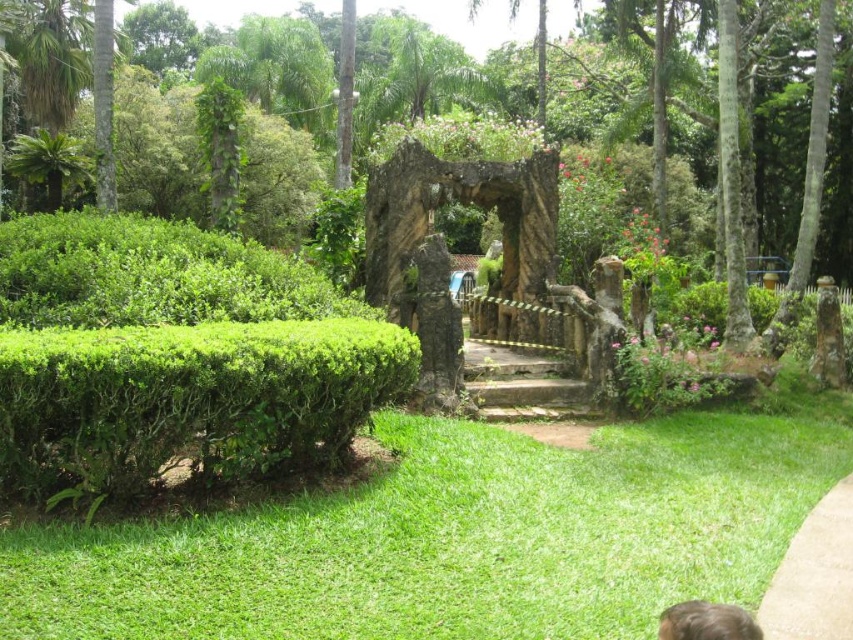
You are a gardener planning to plant a new row of flowers between the green leafy hedge at left and the concrete at center. Based on their positions, which object is closer to the front of the garden scene?

The green leafy hedge at left is closer to the front of the garden scene since it is positioned over the concrete at center, indicating it is in front.

You are standing in the tropical garden and want to take a photo of the green leafy hedge at left. Where should you position yourself to capture it in the frame?

The green leafy hedge at left is located at point (173, 356), so you should position yourself in the left side of the frame to capture it in the photo.

You are a gardener standing at the entrance of the garden. You need to water both the green leafy hedge at left and the brown stone stairs at center. Which object should you water first if you want to start from the nearest object to you?

The green leafy hedge at left should be watered first because it is in front of the brown stone stairs at center, making it closer to your current position at the entrance.